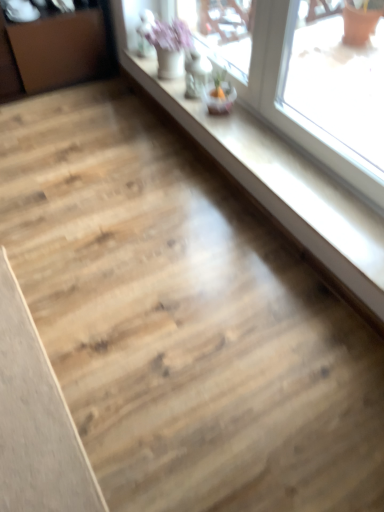
This screenshot has height=512, width=384. Find the location of `vacant area located to the right-hand side of light brown wood plank at lower left`. vacant area located to the right-hand side of light brown wood plank at lower left is located at coordinates click(181, 368).